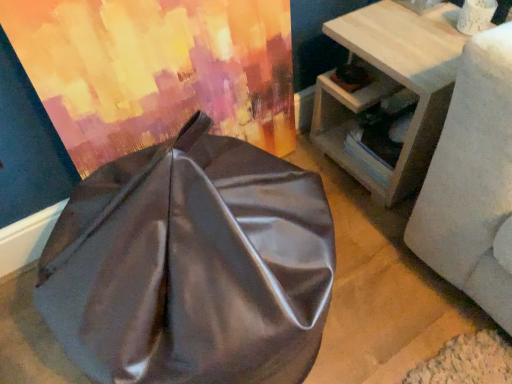
Question: Does satin fabric curtain at upper left have a smaller size compared to satin gray bean bag at center?

Choices:
 (A) yes
 (B) no

Answer: (A)

Question: Does satin fabric curtain at upper left have a lesser height compared to satin gray bean bag at center?

Choices:
 (A) yes
 (B) no

Answer: (B)

Question: Is satin fabric curtain at upper left to the left of satin gray bean bag at center from the viewer's perspective?

Choices:
 (A) no
 (B) yes

Answer: (B)

Question: Is satin fabric curtain at upper left turned away from satin gray bean bag at center?

Choices:
 (A) yes
 (B) no

Answer: (B)

Question: From a real-world perspective, is satin fabric curtain at upper left positioned over satin gray bean bag at center based on gravity?

Choices:
 (A) no
 (B) yes

Answer: (B)

Question: Based on their positions, is satin gray bean bag at center located to the left or right of satin fabric curtain at upper left?

Choices:
 (A) right
 (B) left

Answer: (A)

Question: In the image, is satin gray bean bag at center positioned in front of or behind satin fabric curtain at upper left?

Choices:
 (A) front
 (B) behind

Answer: (A)

Question: Considering the positions of point (92, 342) and point (37, 57), is point (92, 342) closer or farther from the camera than point (37, 57)?

Choices:
 (A) farther
 (B) closer

Answer: (B)

Question: Looking at their shapes, would you say satin gray bean bag at center is wider or thinner than satin fabric curtain at upper left?

Choices:
 (A) thin
 (B) wide

Answer: (B)

Question: Looking at their shapes, would you say satin gray bean bag at center is wider or thinner than light wood side table at right?

Choices:
 (A) thin
 (B) wide

Answer: (B)

Question: Is point (211, 157) positioned closer to the camera than point (454, 36)?

Choices:
 (A) farther
 (B) closer

Answer: (B)

Question: From the image's perspective, is satin gray bean bag at center located above or below light wood side table at right?

Choices:
 (A) below
 (B) above

Answer: (A)

Question: Relative to light wood side table at right, is satin gray bean bag at center in front or behind?

Choices:
 (A) behind
 (B) front

Answer: (B)

Question: From a real-world perspective, relative to satin fabric curtain at upper left, is light wood side table at right vertically above or below?

Choices:
 (A) below
 (B) above

Answer: (A)

Question: Is light wood side table at right taller or shorter than satin fabric curtain at upper left?

Choices:
 (A) tall
 (B) short

Answer: (B)